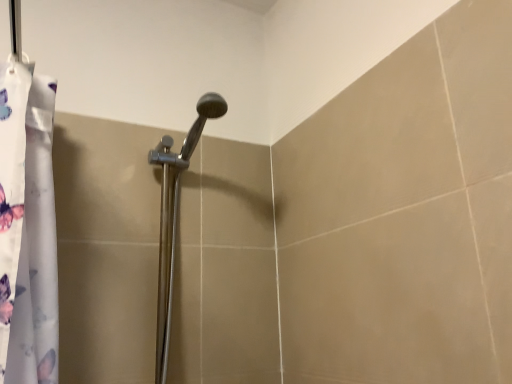
At what (x,y) coordinates should I click in order to perform the action: click on polished chrome shower head at center. Please return your answer as a coordinate pair (x, y). This screenshot has width=512, height=384. Looking at the image, I should click on (174, 217).

The width and height of the screenshot is (512, 384). What do you see at coordinates (174, 217) in the screenshot? I see `polished chrome shower head at center` at bounding box center [174, 217].

Measure the distance between polished chrome shower head at center and camera.

polished chrome shower head at center is 35.95 inches away from camera.

Locate an element on the screen. polished chrome shower head at center is located at coordinates (174, 217).